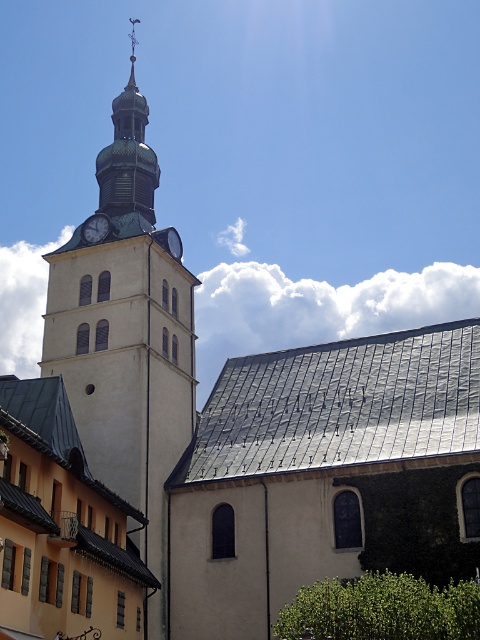
Question: Is matte gray clock at upper left bigger than metallic silver clock at upper center?

Choices:
 (A) no
 (B) yes

Answer: (B)

Question: Does beige stone clock tower at center have a lesser width compared to matte gray clock at upper left?

Choices:
 (A) yes
 (B) no

Answer: (B)

Question: Among these points, which one is nearest to the camera?

Choices:
 (A) (141, 145)
 (B) (172, 234)
 (C) (91, 220)
 (D) (123, 164)

Answer: (C)

Question: Which object appears farthest from the camera in this image?

Choices:
 (A) matte gray clock at upper left
 (B) green wood spire at upper center
 (C) metallic silver clock at upper center

Answer: (B)

Question: Which of these objects is positioned farthest from the matte gray clock at upper left?

Choices:
 (A) metallic silver clock at upper center
 (B) green wood spire at upper center
 (C) beige stone clock tower at center

Answer: (B)

Question: In this image, where is green wood spire at upper center located relative to metallic silver clock at upper center?

Choices:
 (A) below
 (B) above

Answer: (B)